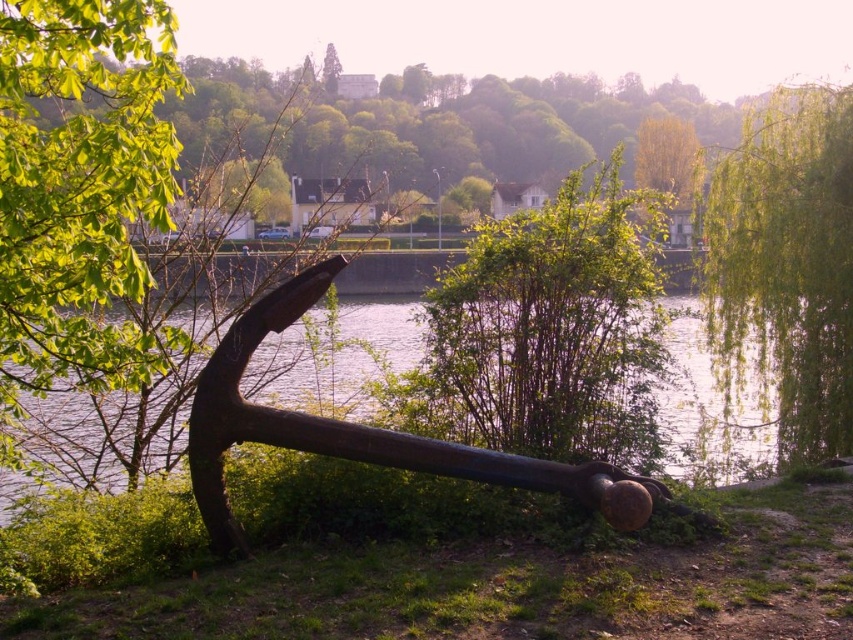
You are standing at the riverside and see the point marked at coordinates [10,172]. If you want to place a small bench there, which is 4 feet wide, will there be enough space around the bench to walk comfortably? Please consider the distance from the viewer to the point as 17.65 feet.

The point at coordinates [10,172] is 17.65 feet away from the viewer. However, the question about space around the bench for walking cannot be determined from the given information as there is no data provided about the surrounding area or obstacles near the point.

You are standing at point A with coordinates point A at (776, 216). You want to walk to point B at 0.662, 0.088. The path between them is 14.82 meters. Is this path long enough to accommodate a 100 meter walk?

The path between point A at (776, 216) and point B at 0.662, 0.088 is only 14.82 meters long, which is much shorter than 100 meters. Therefore, the path is not long enough to accommodate a 100 meter walk.